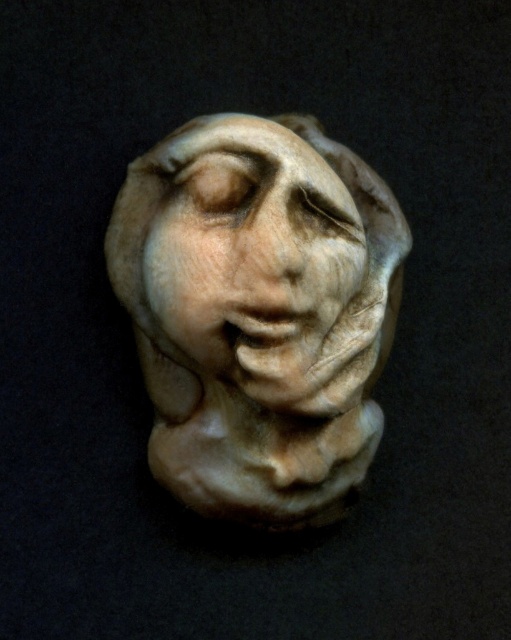
You are an art conservator examining the sculpture. You notice a small point at coordinates point (259, 312). What material is this point part of?

The point (259, 312) corresponds to the white marble sculpture at center, so it is part of the white marble sculpture at center.

You are an art conservator examining the white marble sculpture at center. Based on its position coordinates, can you determine if it is centered precisely in the image?

The white marble sculpture at center is located at point coordinates approximately (259,312), which is very close to the exact center of the image. Therefore, it can be considered centered.

In the scene shown: You are a tour guide standing 1.22 meters away from the white marble sculpture at center. Your group asks if they can get closer to examine the sculpture up close. According to museum guidelines, visitors must stay at least 1.5 meters away from all artifacts. Can they move closer?

The white marble sculpture at center and viewer are 1.22 meters apart from each other. Since the required distance is 1.5 meters, visitors cannot get closer than that. Therefore, the group cannot move closer as they are already within the restricted distance.